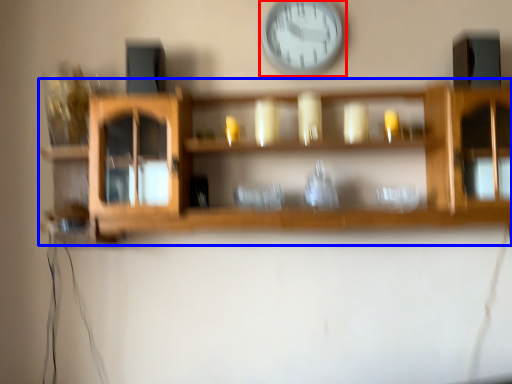
Question: Which object appears closest to the camera in this image, wall clock (highlighted by a red box) or shelf (highlighted by a blue box)?

Choices:
 (A) wall clock
 (B) shelf

Answer: (B)